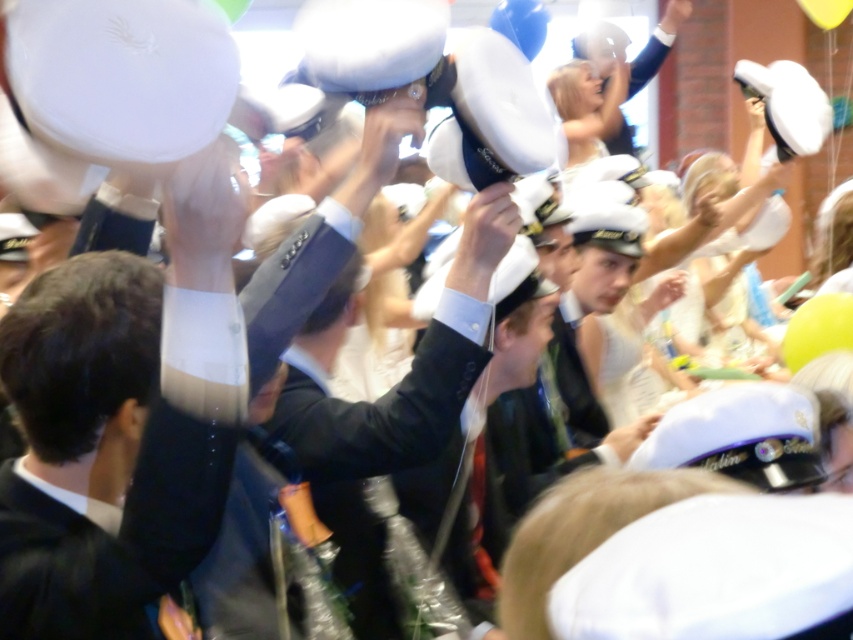
Question: Which is nearer to the yellow rubber balloon at right?

Choices:
 (A) white matte balloon at upper left
 (B) white matte balloon at upper center
 (C) shiny black suit at center
 (D) yellow matte balloon at upper right

Answer: (B)

Question: Which of the following is the farthest from the observer?

Choices:
 (A) blue rubber balloon at upper center
 (B) shiny black suit at center
 (C) yellow rubber balloon at right
 (D) white matte balloon at upper left

Answer: (A)

Question: Can you confirm if shiny black suit at center is wider than yellow rubber balloon at right?

Choices:
 (A) yes
 (B) no

Answer: (A)

Question: Which point is closer to the camera?

Choices:
 (A) white matte balloon at upper left
 (B) white matte balloon at upper center
 (C) blue rubber balloon at upper center

Answer: (A)

Question: Does white matte balloon at upper left have a smaller size compared to yellow matte balloon at upper right?

Choices:
 (A) no
 (B) yes

Answer: (B)

Question: Can you confirm if yellow rubber balloon at right is positioned to the right of yellow matte balloon at upper right?

Choices:
 (A) no
 (B) yes

Answer: (A)